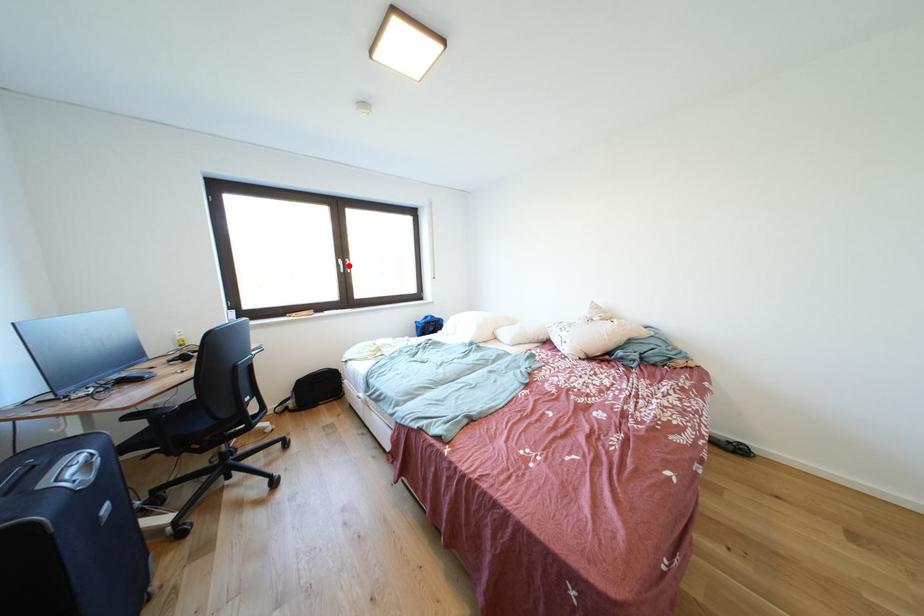
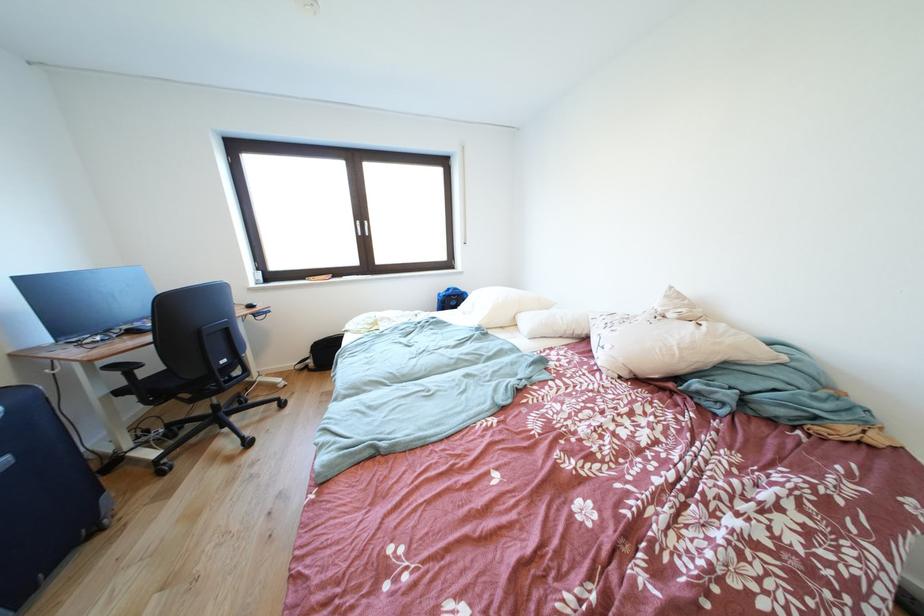
Question: I am providing you with two images of the same scene from different viewpoints. In image1, a red point is highlighted. Considering the same 3D point in image2, which of the following is correct?

Choices:
 (A) It is closer
 (B) It is farther

Answer: (A)